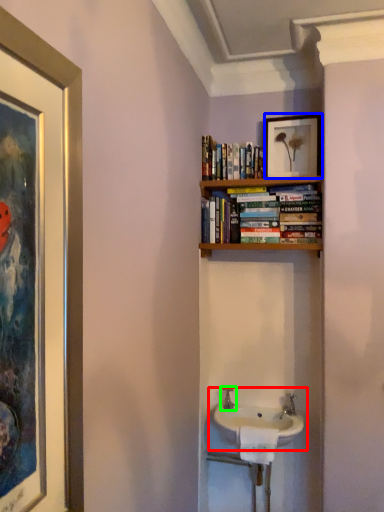
Question: Considering the real-world distances, which object is closest to sink (highlighted by a red box)? picture frame (highlighted by a blue box) or tap (highlighted by a green box).

Choices:
 (A) picture frame
 (B) tap

Answer: (B)